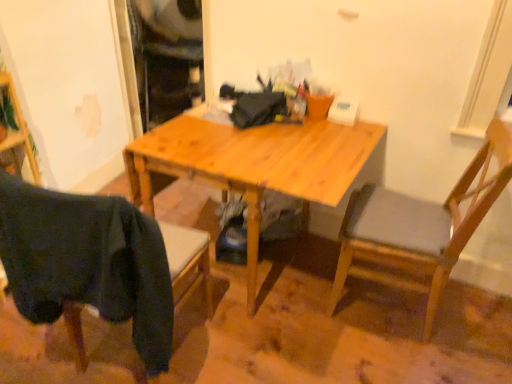
This screenshot has height=384, width=512. Identify the location of free region under wooden chair at right, the 2th chair in the left-to-right sequence (from a real-world perspective). (387, 294).